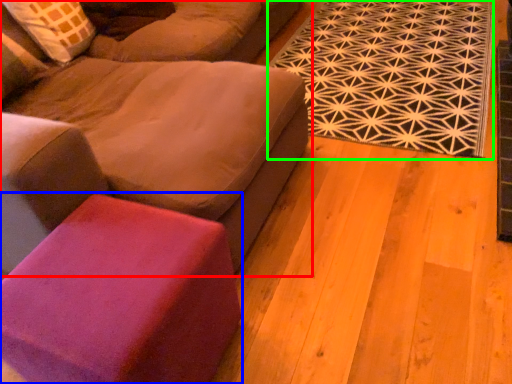
Question: Which object is the farthest from studio couch (highlighted by a red box)? Choose among these: stool (highlighted by a blue box) or mat (highlighted by a green box).

Choices:
 (A) stool
 (B) mat

Answer: (B)